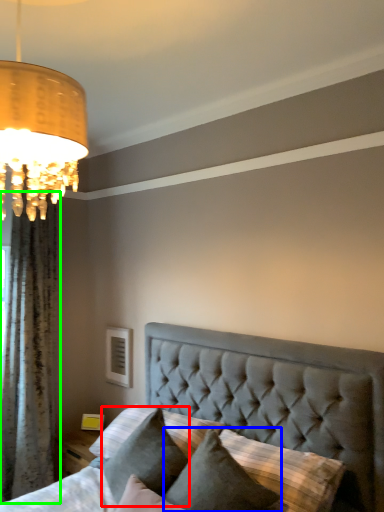
Question: Considering the real-world distances, which object is farthest from pillow (highlighted by a red box)? pillow (highlighted by a blue box) or curtain (highlighted by a green box)?

Choices:
 (A) pillow
 (B) curtain

Answer: (B)